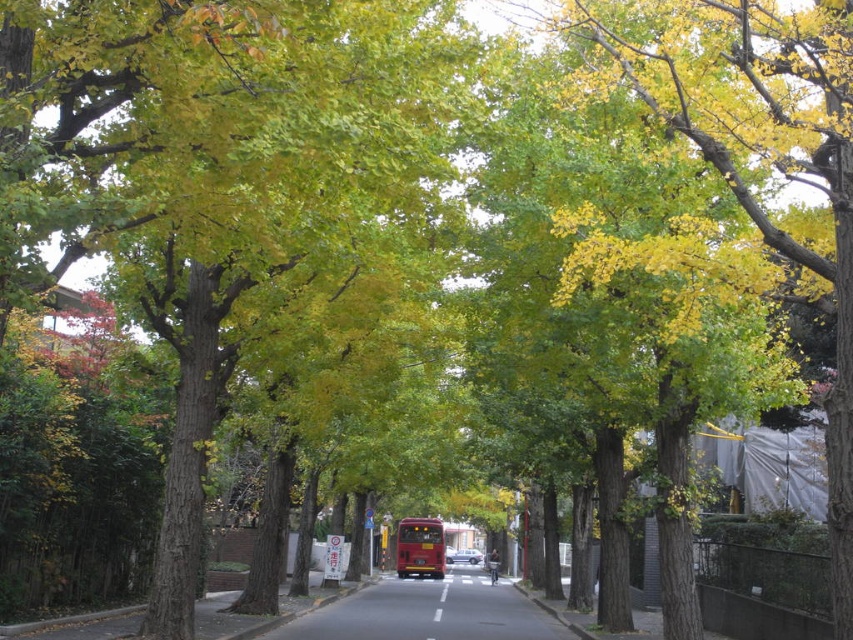
Question: Which object is closer to the camera taking this photo?

Choices:
 (A) metallic silver car at center
 (B) smooth asphalt road at center
 (C) shiny red bus at center

Answer: (B)

Question: Does shiny red bus at center appear under metallic silver car at center?

Choices:
 (A) yes
 (B) no

Answer: (B)

Question: Among these points, which one is nearest to the camera?

Choices:
 (A) click(463, 548)
 (B) click(433, 636)

Answer: (B)

Question: Does smooth asphalt road at center have a smaller size compared to metallic silver car at center?

Choices:
 (A) no
 (B) yes

Answer: (A)

Question: Does shiny red bus at center come in front of metallic silver car at center?

Choices:
 (A) yes
 (B) no

Answer: (A)

Question: Based on their relative distances, which object is nearer to the metallic silver car at center?

Choices:
 (A) shiny red bus at center
 (B) smooth asphalt road at center

Answer: (A)